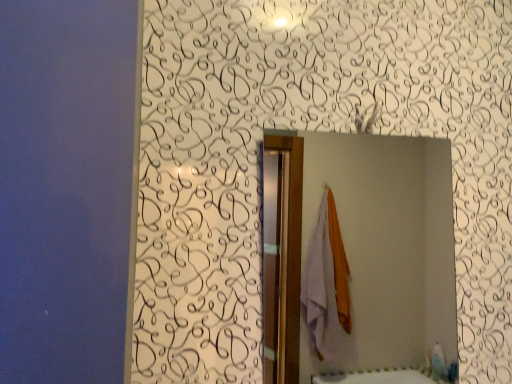
In order to face smooth silver mirror at center, should I rotate leftwards or rightwards?

Turn right approximately 13.730 degrees to face it.

What do you see at coordinates (386, 246) in the screenshot?
I see `smooth silver mirror at center` at bounding box center [386, 246].

Image resolution: width=512 pixels, height=384 pixels. Identify the location of smooth silver mirror at center. (386, 246).

Find the location of `smooth silver mirror at center`. smooth silver mirror at center is located at coordinates (386, 246).